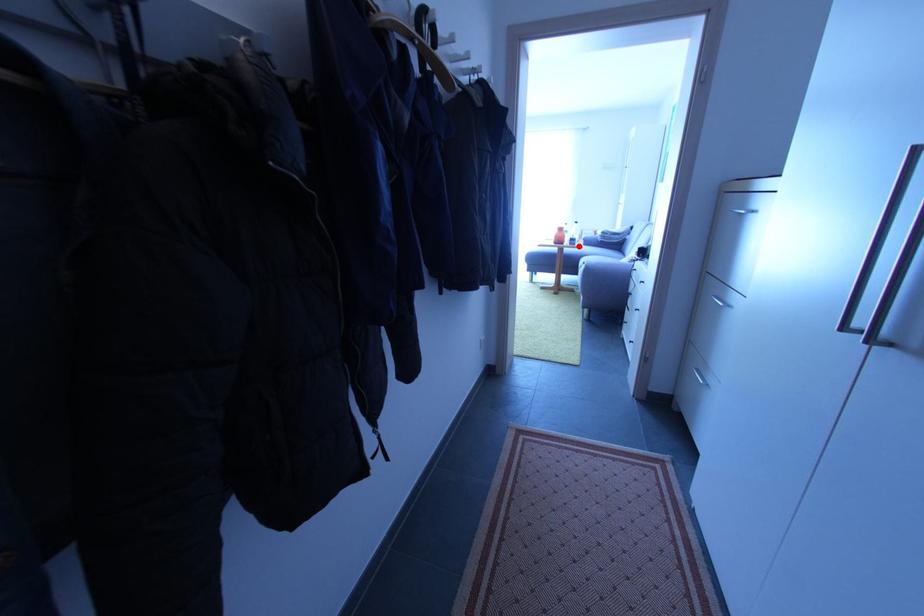
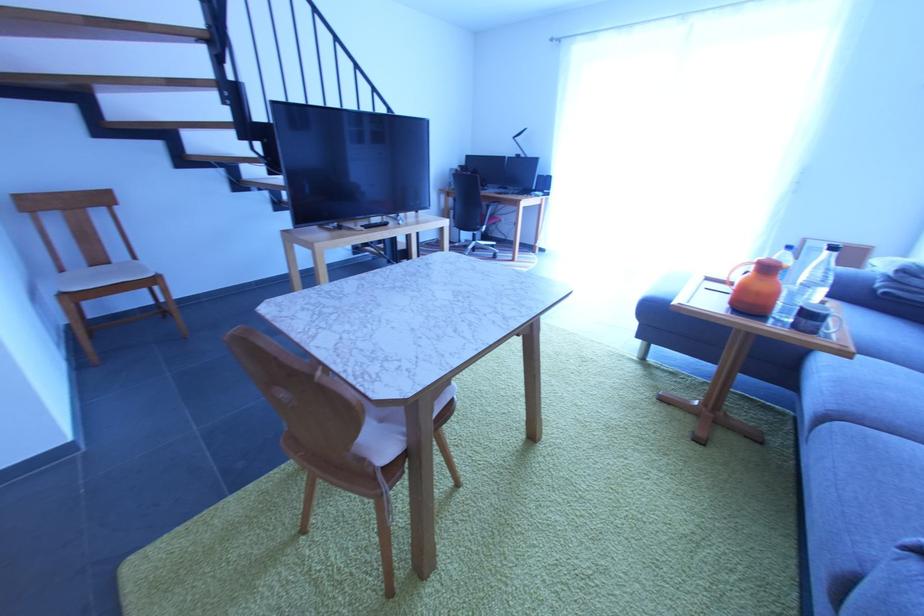
Locate, in the second image, the point that corresponds to the highlighted location in the first image.

(819, 334)